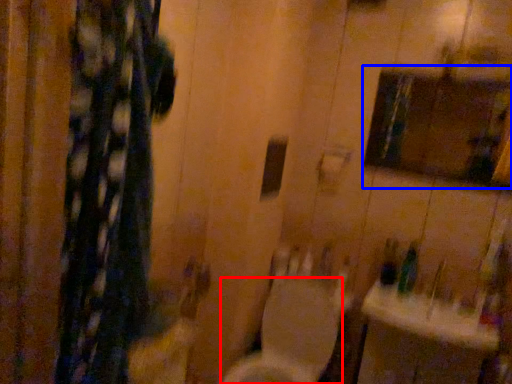
Question: Which object is further to the camera taking this photo, toilet (highlighted by a red box) or medicine cabinet (highlighted by a blue box)?

Choices:
 (A) toilet
 (B) medicine cabinet

Answer: (B)